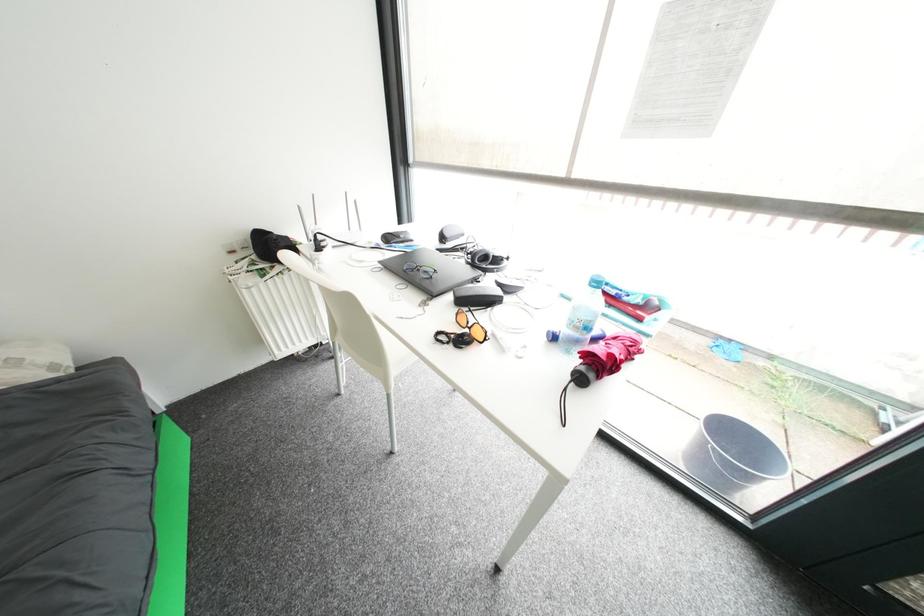
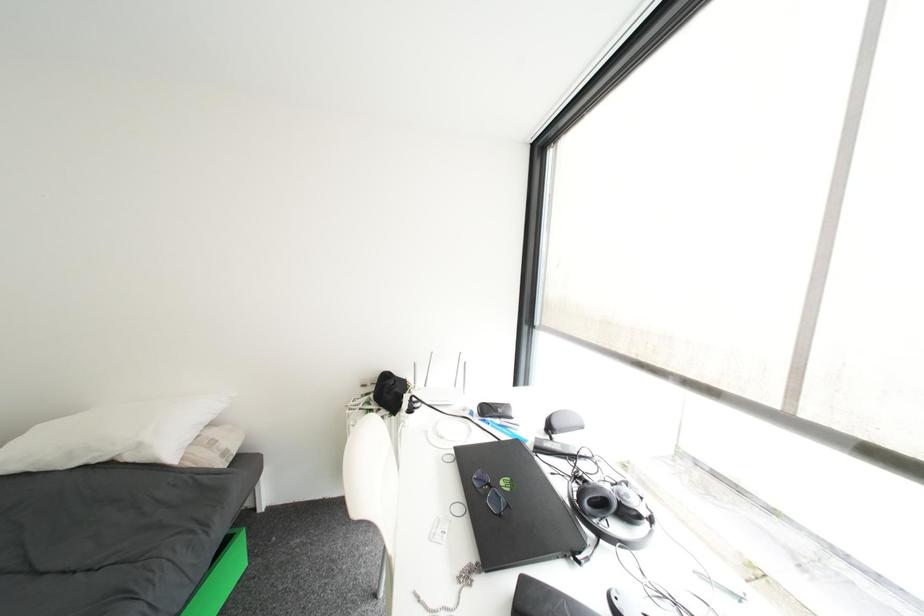
First-person continuous shooting, in which direction is the camera rotating?

The camera's rotation is toward left-up.